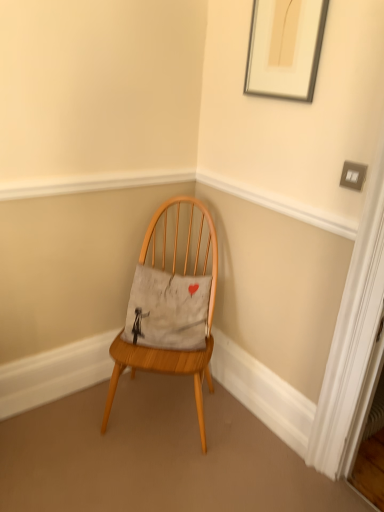
What is the approximate width of gray cotton pillow at center?

It is 12.12 inches.

Find the location of a particular element. silver metallic picture frame at upper right is located at coordinates (285, 48).

Where is `gray cotton pillow at center`? This screenshot has height=512, width=384. gray cotton pillow at center is located at coordinates (168, 309).

Considering the positions of objects gray cotton pillow at center and silver metallic picture frame at upper right in the image provided, who is more to the left, gray cotton pillow at center or silver metallic picture frame at upper right?

From the viewer's perspective, gray cotton pillow at center appears more on the left side.

Which of these two, gray cotton pillow at center or silver metallic picture frame at upper right, stands shorter?

Standing shorter between the two is gray cotton pillow at center.

Do you think gray cotton pillow at center is within silver metallic picture frame at upper right, or outside of it?

gray cotton pillow at center is not inside silver metallic picture frame at upper right, it's outside.

From a real-world perspective, who is located lower, gray cotton pillow at center or silver metallic picture frame at upper right?

From a 3D spatial view, gray cotton pillow at center is below.

Is point (178, 284) more distant than point (139, 269)?

That is False.

Is wooden chair at center shorter than gray cotton pillow at center?

Incorrect, the height of wooden chair at center does not fall short of that of gray cotton pillow at center.

From the image's perspective, is wooden chair at center positioned above or below gray cotton pillow at center?

wooden chair at center is situated lower than gray cotton pillow at center in the image.

How different are the orientations of wooden chair at center and gray cotton pillow at center in degrees?

There is a 1.88-degree angle between the facing directions of wooden chair at center and gray cotton pillow at center.

Does wooden chair at center have a larger size compared to silver metallic picture frame at upper right?

Yes, wooden chair at center is bigger than silver metallic picture frame at upper right.

Where is `picture frame on the right of wooden chair at center`? This screenshot has width=384, height=512. picture frame on the right of wooden chair at center is located at coordinates (285, 48).

What's the angular difference between wooden chair at center and silver metallic picture frame at upper right's facing directions?

44.6 degrees.

Which object is more forward, wooden chair at center or silver metallic picture frame at upper right?

silver metallic picture frame at upper right is more forward.

Where is `pillow positioned vertically above the wooden chair at center (from a real-world perspective)`? This screenshot has width=384, height=512. pillow positioned vertically above the wooden chair at center (from a real-world perspective) is located at coordinates (168, 309).

From the picture: How far apart are gray cotton pillow at center and wooden chair at center?

The distance of gray cotton pillow at center from wooden chair at center is 2.21 inches.

Is gray cotton pillow at center at the left side of wooden chair at center?

Indeed, gray cotton pillow at center is positioned on the left side of wooden chair at center.

Is wooden chair at center completely or partially inside gray cotton pillow at center?

No, gray cotton pillow at center does not contain wooden chair at center.

You are a GUI agent. You are given a task and a screenshot of the screen. Output one action in this format:
    pyautogui.click(x=<x>, y=<y>)
    Task: Click on the picture frame that is above the wooden chair at center (from the image's perspective)
    
    Given the screenshot: What is the action you would take?
    pyautogui.click(x=285, y=48)

Which is nearer, (x=282, y=18) or (x=154, y=221)?

Point (x=282, y=18)

Is silver metallic picture frame at upper right facing towards wooden chair at center?

No.

Based on the photo, is silver metallic picture frame at upper right outside of wooden chair at center?

Absolutely, silver metallic picture frame at upper right is external to wooden chair at center.

From a real-world perspective, between silver metallic picture frame at upper right and gray cotton pillow at center, who is vertically lower?

gray cotton pillow at center, from a real-world perspective.

Considering their positions, is silver metallic picture frame at upper right located in front of or behind gray cotton pillow at center?

Visually, silver metallic picture frame at upper right is located in front of gray cotton pillow at center.

Between silver metallic picture frame at upper right and gray cotton pillow at center, which one has smaller width?

Thinner between the two is silver metallic picture frame at upper right.

In the scene shown: From the image's perspective, relative to gray cotton pillow at center, is silver metallic picture frame at upper right above or below?

Clearly, from the image's perspective, silver metallic picture frame at upper right is above gray cotton pillow at center.

What are the coordinates of `picture frame that appears above the gray cotton pillow at center (from a real-world perspective)` in the screenshot? It's located at (285, 48).

You are a GUI agent. You are given a task and a screenshot of the screen. Output one action in this format:
    pyautogui.click(x=<x>, y=<y>)
    Task: Click on the chair located on the right of gray cotton pillow at center
    
    Given the screenshot: What is the action you would take?
    pyautogui.click(x=170, y=312)

Looking at the image, which one is located closer to gray cotton pillow at center, wooden chair at center or silver metallic picture frame at upper right?

wooden chair at center.

In the scene shown: Looking at the image, which one is located closer to gray cotton pillow at center, silver metallic picture frame at upper right or wooden chair at center?

The object closer to gray cotton pillow at center is wooden chair at center.

Based on their spatial positions, is gray cotton pillow at center or wooden chair at center closer to silver metallic picture frame at upper right?

wooden chair at center.

Considering their positions, is gray cotton pillow at center positioned closer to wooden chair at center than silver metallic picture frame at upper right?

The object closer to wooden chair at center is gray cotton pillow at center.

From the picture: Estimate the real-world distances between objects in this image. Which object is further from wooden chair at center, silver metallic picture frame at upper right or gray cotton pillow at center?

Based on the image, silver metallic picture frame at upper right appears to be further to wooden chair at center.

Looking at the image, which one is located further to silver metallic picture frame at upper right, wooden chair at center or gray cotton pillow at center?

The object further to silver metallic picture frame at upper right is gray cotton pillow at center.

At what (x,y) coordinates should I click in order to perform the action: click on pillow between silver metallic picture frame at upper right and wooden chair at center from top to bottom. Please return your answer as a coordinate pair (x, y). The height and width of the screenshot is (512, 384). Looking at the image, I should click on (168, 309).